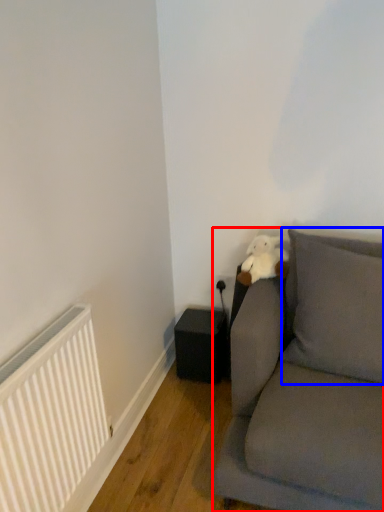
Question: Which of the following is the closest to the observer, studio couch (highlighted by a red box) or pillow (highlighted by a blue box)?

Choices:
 (A) studio couch
 (B) pillow

Answer: (A)